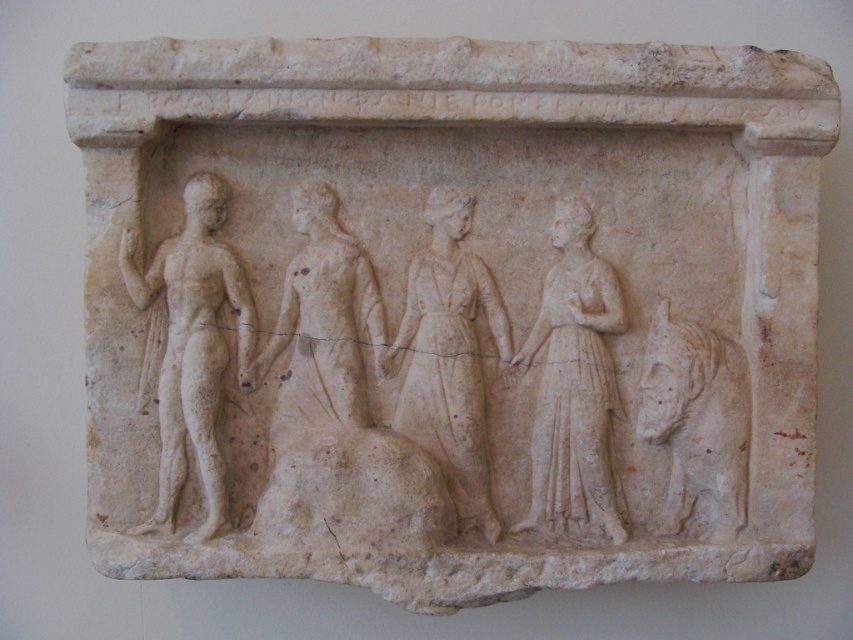
Question: Among these objects, which one is nearest to the camera?

Choices:
 (A) smooth white figure at center
 (B) smooth white figure at left

Answer: (B)

Question: Is smooth white figure at left wider than white marble figure at center?

Choices:
 (A) no
 (B) yes

Answer: (B)

Question: Can you confirm if smooth white figure at left is positioned below smooth white robe at center?

Choices:
 (A) yes
 (B) no

Answer: (B)

Question: Is the position of smooth white robe at center more distant than that of white stone horse at right?

Choices:
 (A) yes
 (B) no

Answer: (A)

Question: Which of these objects is positioned farthest from the white stone horse at right?

Choices:
 (A) smooth white robe at center
 (B) white marble figure at center

Answer: (A)

Question: Which point is closer to the camera?

Choices:
 (A) smooth white robe at center
 (B) smooth white figure at center

Answer: (B)